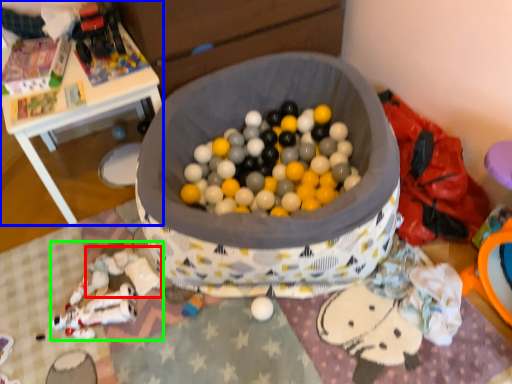
Question: Based on their relative distances, which object is nearer to toy (highlighted by a red box)? Choose from table (highlighted by a blue box) and toy (highlighted by a green box).

Choices:
 (A) table
 (B) toy

Answer: (B)